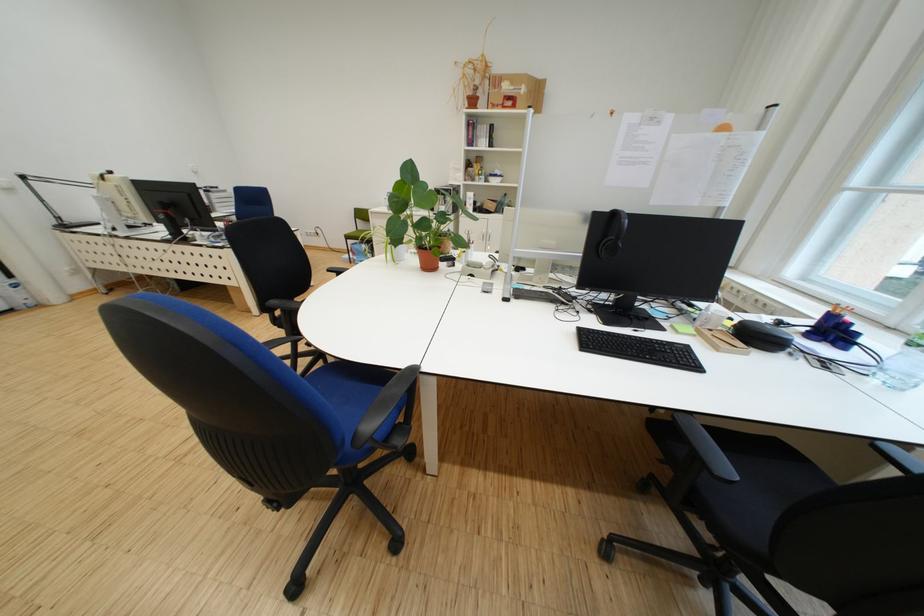
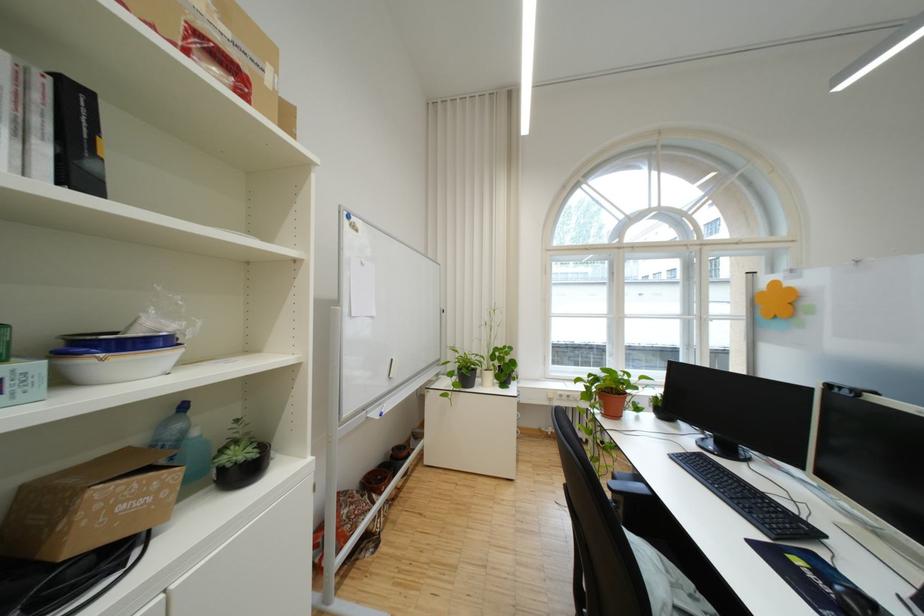
In the second image, find the point that corresponds to [503,180] in the first image.

(117, 365)